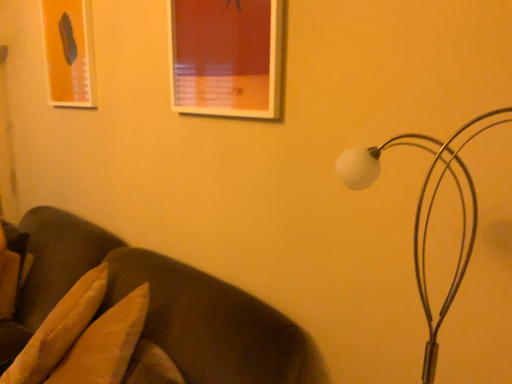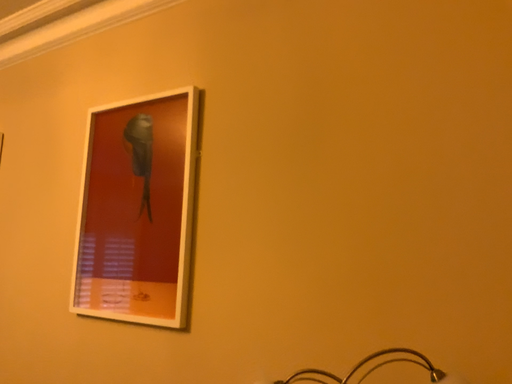
Question: How did the camera likely rotate when shooting the video?

Choices:
 (A) rotated upward
 (B) rotated downward

Answer: (A)